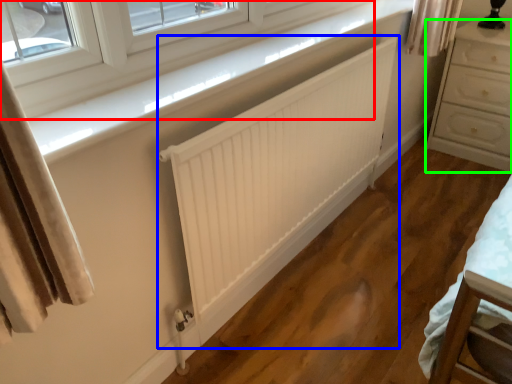
Question: Which object is the closest to the window (highlighted by a red box)? Choose among these: radiator (highlighted by a blue box) or chest of drawers (highlighted by a green box).

Choices:
 (A) radiator
 (B) chest of drawers

Answer: (A)